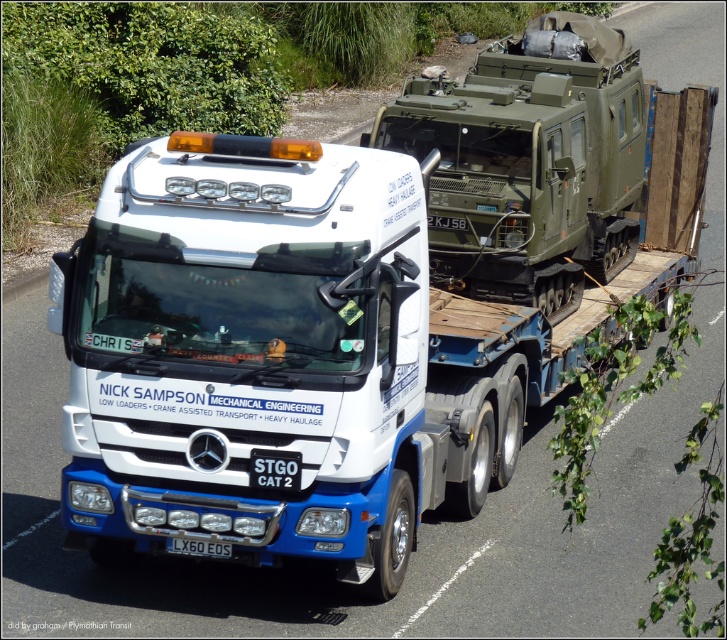
From the picture: You are a photographer trying to capture the white matte truck at center and the white plastic license plate at lower center in a single frame. Based on their positions, which object should you adjust your camera to focus on first to ensure both are in the shot?

The white plastic license plate at lower center should be focused on first since the white matte truck at center is to the right of it, meaning the license plate is closer to the left edge of the frame. By centering the license plate and adjusting the camera angle slightly to the right, both objects can be captured in the frame.

You are a traffic controller at a construction site. You need to direct a white matte truck at center to a parking spot located at coordinate point 0.564, 0.389. Is the truck already at the correct parking spot?

The white matte truck at center is already positioned at the coordinate point (281, 360), so it is already at the correct parking spot.

You are a delivery driver who needs to check the license plate of the white matte truck at center. Can you see the white plastic license plate at lower center clearly from the truck?

The white matte truck at center is positioned over the white plastic license plate at lower center, so the license plate is likely obscured and not visible from the truck.